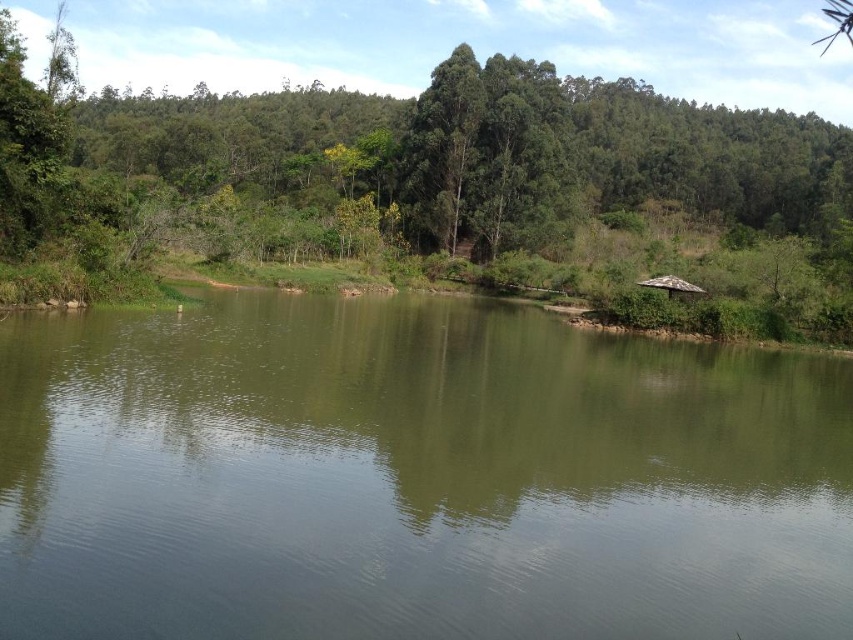
Which is above, green leafy tree at center or brown wooden hut at right?

green leafy tree at center is higher up.

Who is more distant from viewer, (x=759, y=161) or (x=679, y=282)?

The point (x=759, y=161) is more distant.

I want to click on green leafy tree at center, so click(x=434, y=180).

Measure the distance from green matte lake at center to green leafy tree at center.

green matte lake at center is 95.66 meters from green leafy tree at center.

Does green matte lake at center have a greater width compared to green leafy tree at center?

In fact, green matte lake at center might be narrower than green leafy tree at center.

Locate an element on the screen. The height and width of the screenshot is (640, 853). green matte lake at center is located at coordinates (413, 477).

Can you confirm if green matte lake at center is positioned below brown wooden hut at right?

Yes, green matte lake at center is below brown wooden hut at right.

Measure the distance between green matte lake at center and camera.

green matte lake at center is 10.66 meters away from camera.

Is point (154, 317) in front of point (672, 285)?

That is True.

Locate an element on the screen. This screenshot has height=640, width=853. green matte lake at center is located at coordinates (413, 477).